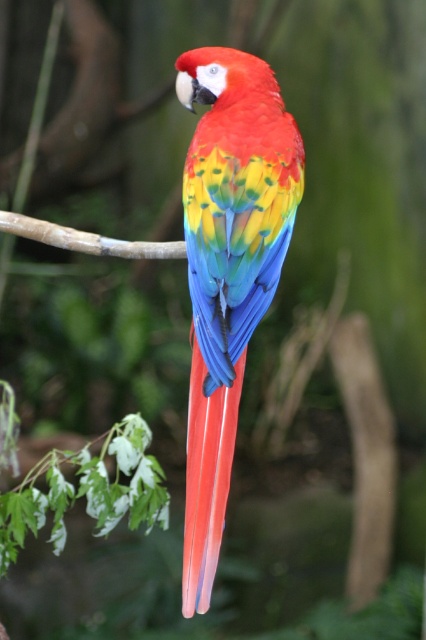
Does glossy feathers parrot at center have a lesser height compared to brown smooth branch at center?

Incorrect, glossy feathers parrot at center's height does not fall short of brown smooth branch at center's.

From the picture: Who is more distant from viewer, (281,113) or (86,237)?

The point (86,237) is behind.

This screenshot has height=640, width=426. I want to click on glossy feathers parrot at center, so click(x=227, y=268).